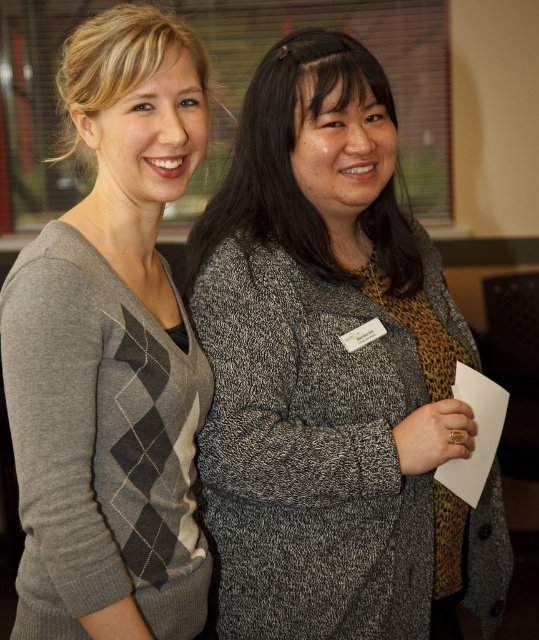
You are a photographer standing 5 feet away from the camera. You want to take a picture of the speckled gray sweater at center. Can you reach the sweater without moving the camera?

The speckled gray sweater at center and camera are 3.96 feet apart from each other. Since you are 5 feet away from the camera, the total distance between you and the sweater is 8.96 feet. You cannot reach the sweater without moving the camera because it is too far away.

In the scene shown: Based on the scene description, which sweater is positioned lower between the speckled gray sweater at center and the gray argyle sweater at left?

The speckled gray sweater at center is positioned lower than the gray argyle sweater at left according to the description.